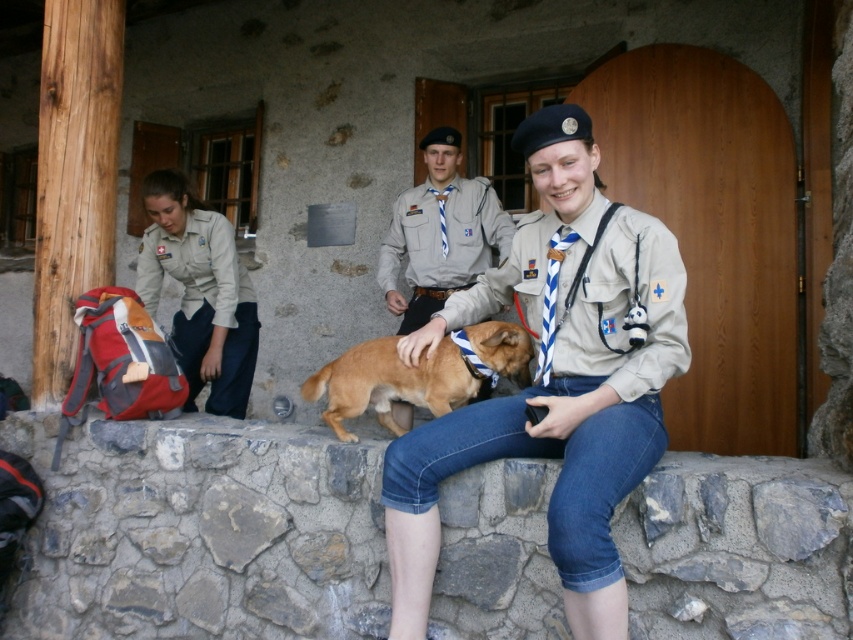
Question: Which object is farther from the camera taking this photo?

Choices:
 (A) khaki fabric shirt at center
 (B) brown furry dog at center
 (C) matte khaki uniform at left

Answer: (C)

Question: Based on their relative distances, which object is farther from the light brown uniform at center?

Choices:
 (A) khaki fabric shirt at center
 (B) matte khaki uniform at left
 (C) brown furry dog at center

Answer: (A)

Question: Which object appears farthest from the camera in this image?

Choices:
 (A) light brown uniform at center
 (B) matte khaki uniform at left

Answer: (A)

Question: Can you confirm if khaki fabric shirt at center is positioned to the left of matte khaki uniform at left?

Choices:
 (A) no
 (B) yes

Answer: (A)

Question: Where is khaki fabric shirt at center located in relation to light brown uniform at center in the image?

Choices:
 (A) above
 (B) below

Answer: (B)

Question: Considering the relative positions of khaki fabric shirt at center and brown furry dog at center in the image provided, where is khaki fabric shirt at center located with respect to brown furry dog at center?

Choices:
 (A) below
 (B) above

Answer: (B)